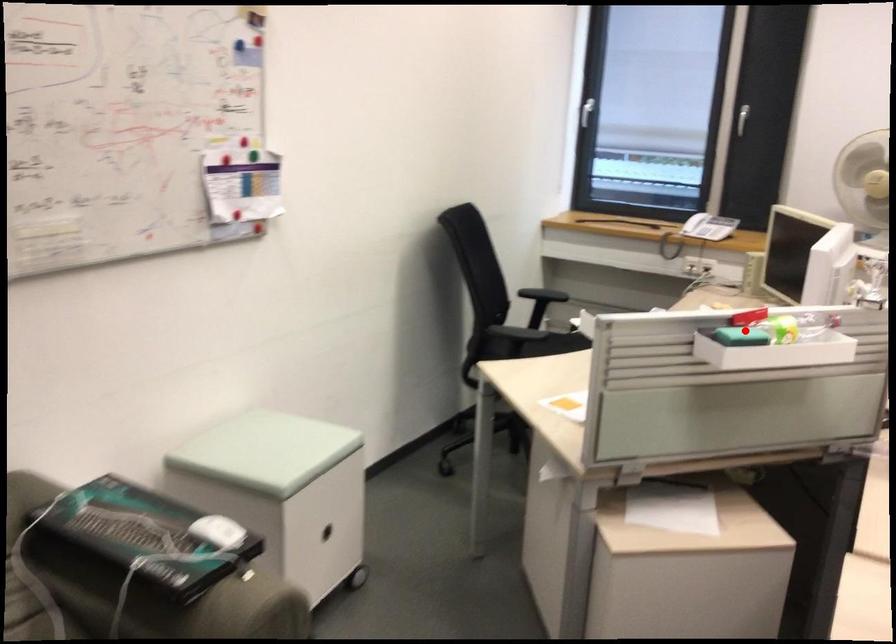
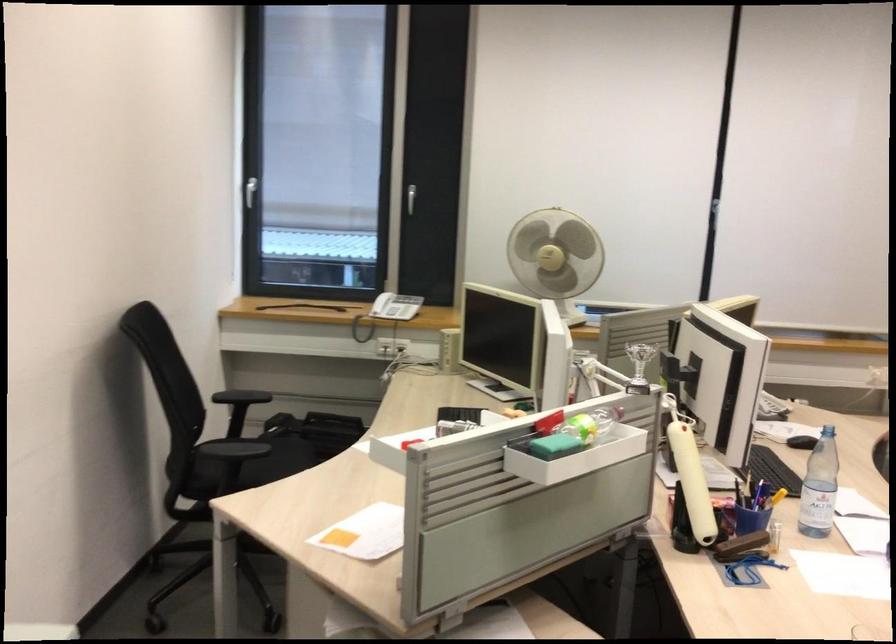
Find the pixel in the second image that matches the highlighted location in the first image.

(554, 446)